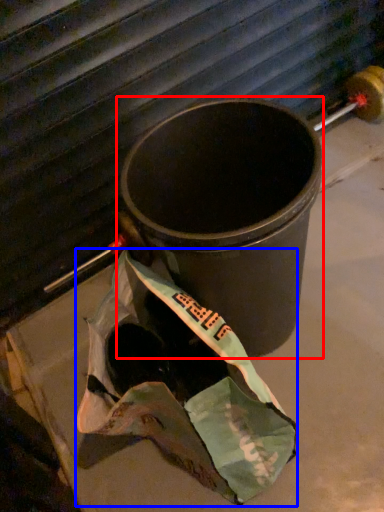
Question: Which point is closer to the camera, waste container (highlighted by a red box) or grocery bag (highlighted by a blue box)?

Choices:
 (A) waste container
 (B) grocery bag

Answer: (B)